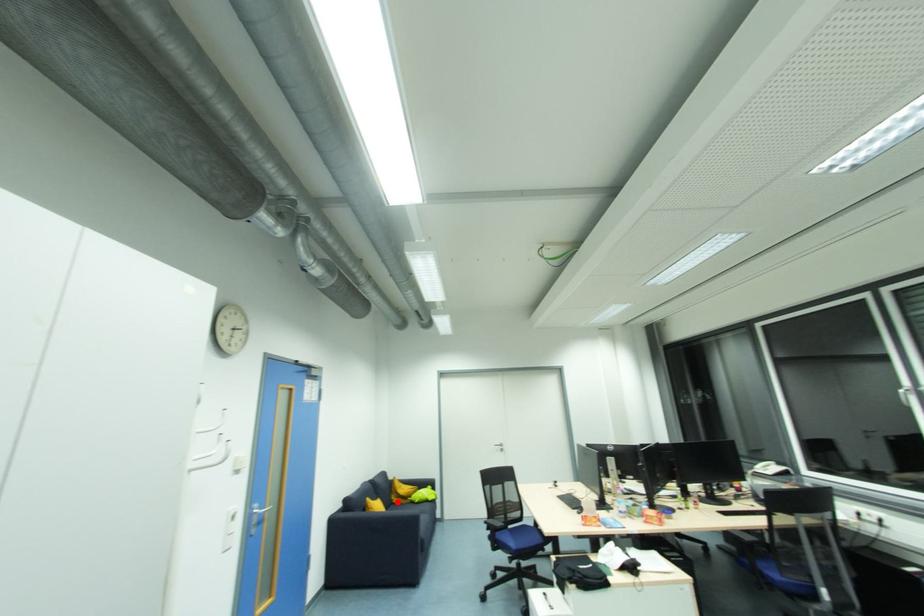
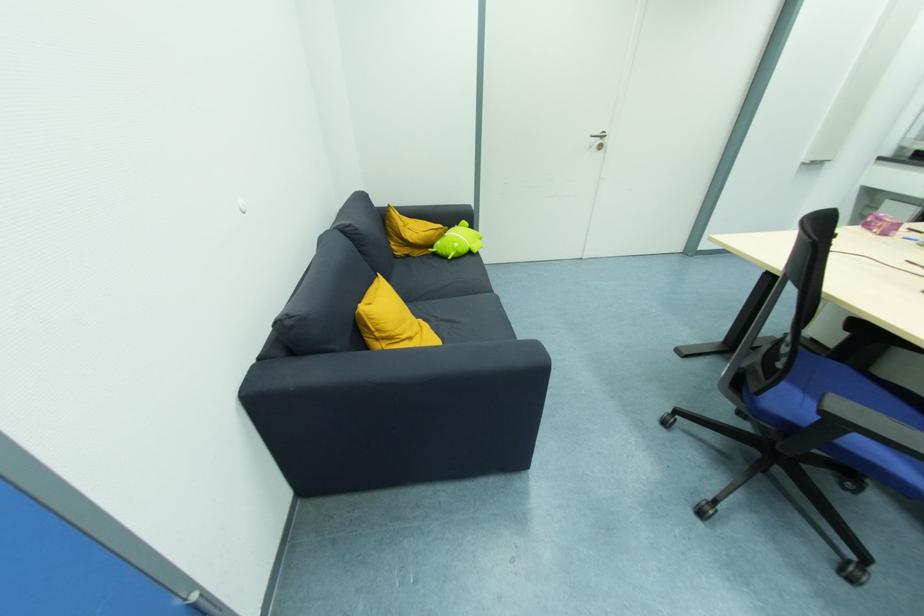
Question: I am providing you with two images of the same scene from different viewpoints. A red point is shown in image1. For the corresponding object point in image2, is it positioned nearer or farther from the camera?

Choices:
 (A) Nearer
 (B) Farther

Answer: (A)